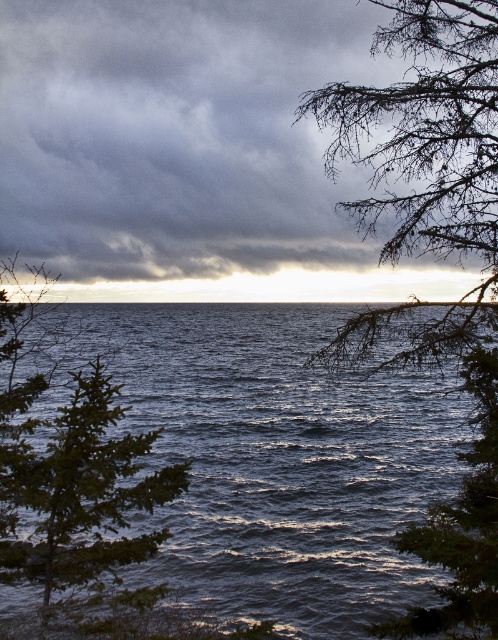
Question: Can you confirm if dark blue water at center is positioned to the right of green matte tree at left?

Choices:
 (A) yes
 (B) no

Answer: (A)

Question: Can you confirm if dark gray cloud at upper center is positioned above green textured branches at upper right?

Choices:
 (A) yes
 (B) no

Answer: (A)

Question: Among these objects, which one is farthest from the camera?

Choices:
 (A) green matte tree at left
 (B) dark gray cloud at upper center
 (C) dark blue water at center

Answer: (B)

Question: Estimate the real-world distances between objects in this image. Which object is farther from the green matte tree at left?

Choices:
 (A) dark blue water at center
 (B) green textured branches at upper right

Answer: (A)

Question: Is dark gray cloud at upper center to the left of dark blue water at center from the viewer's perspective?

Choices:
 (A) no
 (B) yes

Answer: (A)

Question: Which of the following is the farthest from the observer?

Choices:
 (A) green matte tree at left
 (B) dark blue water at center
 (C) green textured branches at upper right

Answer: (B)